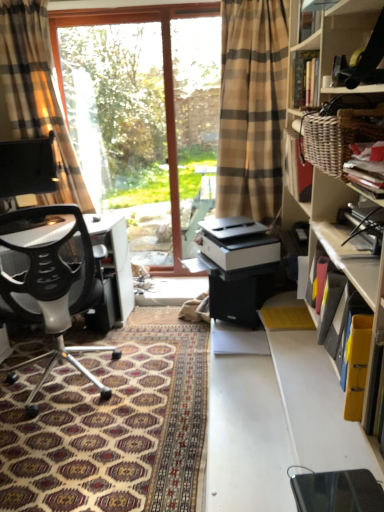
The width and height of the screenshot is (384, 512). Find the location of `vacant region above transparent glass window at center (from a real-world perspective)`. vacant region above transparent glass window at center (from a real-world perspective) is located at coordinates (97, 12).